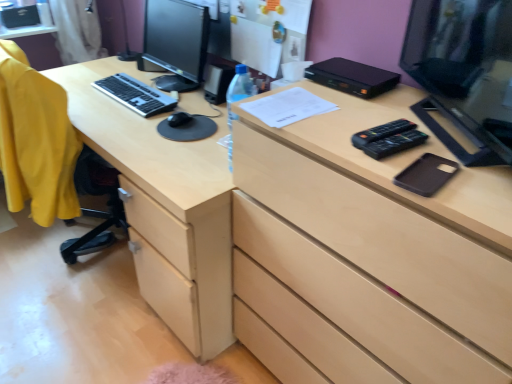
Question: Does yellow fabric computer chair at left have a larger size compared to black glossy monitor at upper right, the second computer monitor positioned from the back?

Choices:
 (A) no
 (B) yes

Answer: (B)

Question: Is yellow fabric computer chair at left not close to black glossy monitor at upper right, the second computer monitor positioned from the back?

Choices:
 (A) yes
 (B) no

Answer: (A)

Question: Is yellow fabric computer chair at left to the left of black glossy monitor at upper right, the second computer monitor positioned from the back, from the viewer's perspective?

Choices:
 (A) yes
 (B) no

Answer: (A)

Question: Can black glossy monitor at upper right, the second computer monitor positioned from the back, be found inside yellow fabric computer chair at left?

Choices:
 (A) no
 (B) yes

Answer: (A)

Question: From the image's perspective, is yellow fabric computer chair at left over black glossy monitor at upper right, the second computer monitor positioned from the back?

Choices:
 (A) no
 (B) yes

Answer: (A)

Question: Does yellow fabric computer chair at left have a smaller size compared to black glossy monitor at upper right, which is counted as the 2th computer monitor, starting from the left?

Choices:
 (A) yes
 (B) no

Answer: (B)

Question: Does silver metallic keyboard at center-left contain matte black monitor at center left, the 1th computer monitor from the left?

Choices:
 (A) yes
 (B) no

Answer: (B)

Question: Is silver metallic keyboard at center-left at the left side of matte black monitor at center left, the first computer monitor positioned from the back?

Choices:
 (A) yes
 (B) no

Answer: (A)

Question: Is silver metallic keyboard at center-left placed right next to matte black monitor at center left, the 1th computer monitor from the left?

Choices:
 (A) no
 (B) yes

Answer: (A)

Question: Is silver metallic keyboard at center-left not close to matte black monitor at center left, the 1th computer monitor from the left?

Choices:
 (A) no
 (B) yes

Answer: (A)

Question: From the image's perspective, is silver metallic keyboard at center-left located above matte black monitor at center left, marked as the second computer monitor in a right-to-left arrangement?

Choices:
 (A) no
 (B) yes

Answer: (A)

Question: Does silver metallic keyboard at center-left have a greater width compared to matte black monitor at center left, the first computer monitor positioned from the back?

Choices:
 (A) no
 (B) yes

Answer: (A)

Question: From the image's perspective, is light wood chest of drawers at center over matte black monitor at center left, the 1th computer monitor from the left?

Choices:
 (A) yes
 (B) no

Answer: (B)